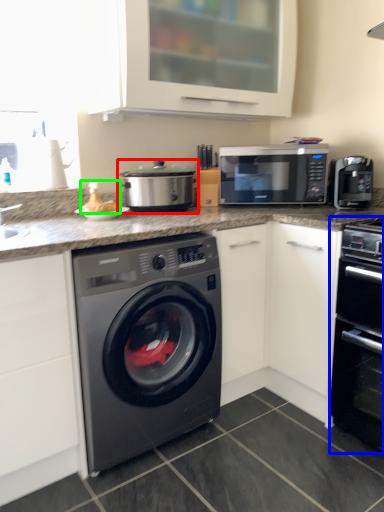
Question: Which object is the closest to the appliance (highlighted by a red box)? Choose among these: oven (highlighted by a blue box) or food (highlighted by a green box).

Choices:
 (A) oven
 (B) food

Answer: (B)